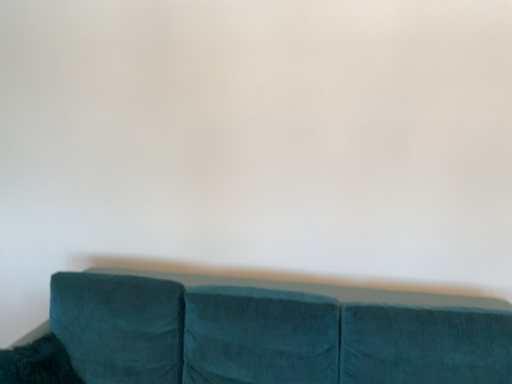
What do you see at coordinates (261, 333) in the screenshot?
I see `teal velvet couch at lower center` at bounding box center [261, 333].

This screenshot has width=512, height=384. Identify the location of teal velvet couch at lower center. (261, 333).

You are a GUI agent. You are given a task and a screenshot of the screen. Output one action in this format:
    pyautogui.click(x=<x>, y=<y>)
    Task: Click on the teal velvet couch at lower center
    
    Given the screenshot: What is the action you would take?
    pyautogui.click(x=261, y=333)